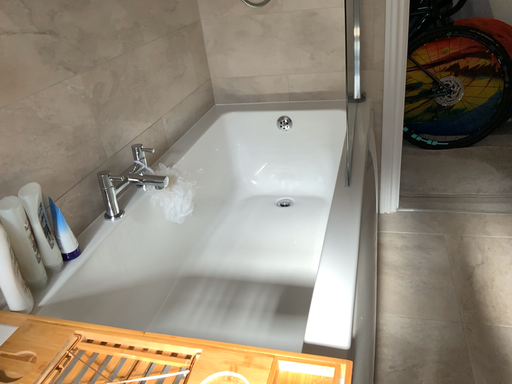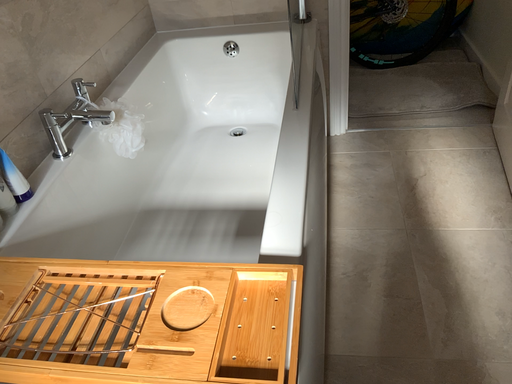
Question: Which way did the camera rotate in the video?

Choices:
 (A) rotated downward
 (B) rotated upward

Answer: (A)